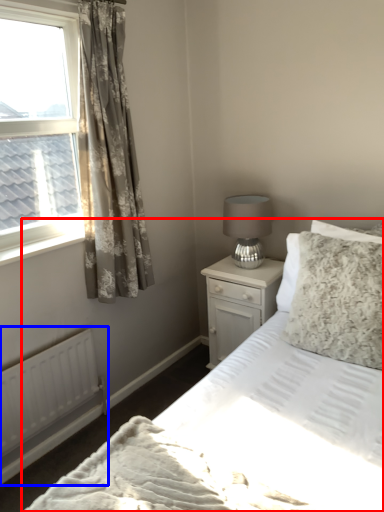
Question: Which object appears closest to the camera in this image, bed (highlighted by a red box) or radiator (highlighted by a blue box)?

Choices:
 (A) bed
 (B) radiator

Answer: (A)